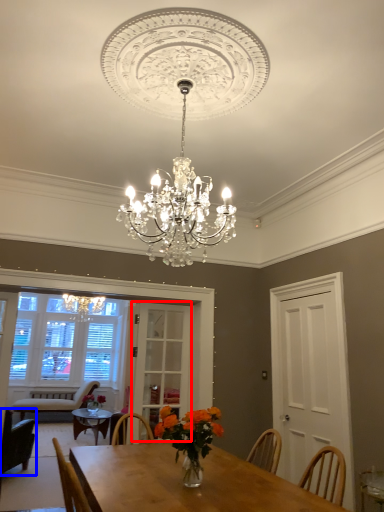
Question: Which object appears closest to the camera in this image, glass door (highlighted by a red box) or chair (highlighted by a blue box)?

Choices:
 (A) glass door
 (B) chair

Answer: (A)